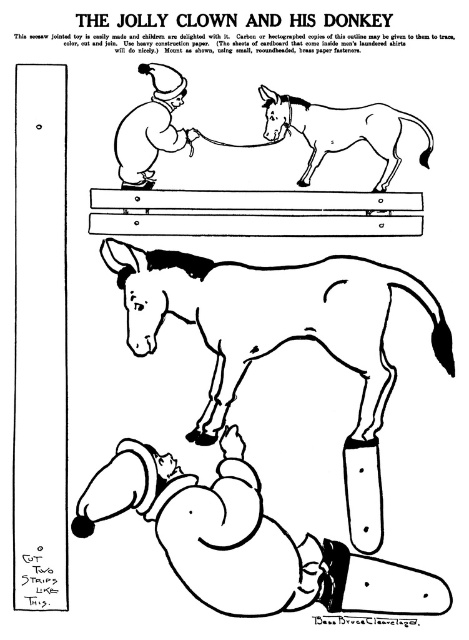
Can you confirm if brown paper donkey at upper center is positioned to the right of matte black clown at upper left?

Yes, brown paper donkey at upper center is to the right of matte black clown at upper left.

Which is above, brown paper donkey at upper center or matte black clown at upper left?

matte black clown at upper left is higher up.

Is point (420, 154) positioned in front of point (122, 154)?

No, (420, 154) is further to viewer.

At what (x,y) coordinates should I click in order to perform the action: click on brown paper donkey at upper center. Please return your answer as a coordinate pair (x, y). Image resolution: width=469 pixels, height=640 pixels. Looking at the image, I should click on (340, 131).

Is white paper horse at lower center to the right of smooth wood plank at center from the viewer's perspective?

Correct, you'll find white paper horse at lower center to the right of smooth wood plank at center.

The image size is (469, 640). What are the coordinates of `white paper horse at lower center` in the screenshot? It's located at (279, 336).

Can you confirm if white paper horse at lower center is positioned to the right of matte black clown at upper left?

Yes, white paper horse at lower center is to the right of matte black clown at upper left.

Is point (308, 317) closer to camera compared to point (176, 100)?

Yes, point (308, 317) is in front of point (176, 100).

What do you see at coordinates (279, 336) in the screenshot? I see `white paper horse at lower center` at bounding box center [279, 336].

You are a GUI agent. You are given a task and a screenshot of the screen. Output one action in this format:
    pyautogui.click(x=<x>, y=<y>)
    Task: Click on the white paper horse at lower center
    
    Given the screenshot: What is the action you would take?
    pyautogui.click(x=279, y=336)